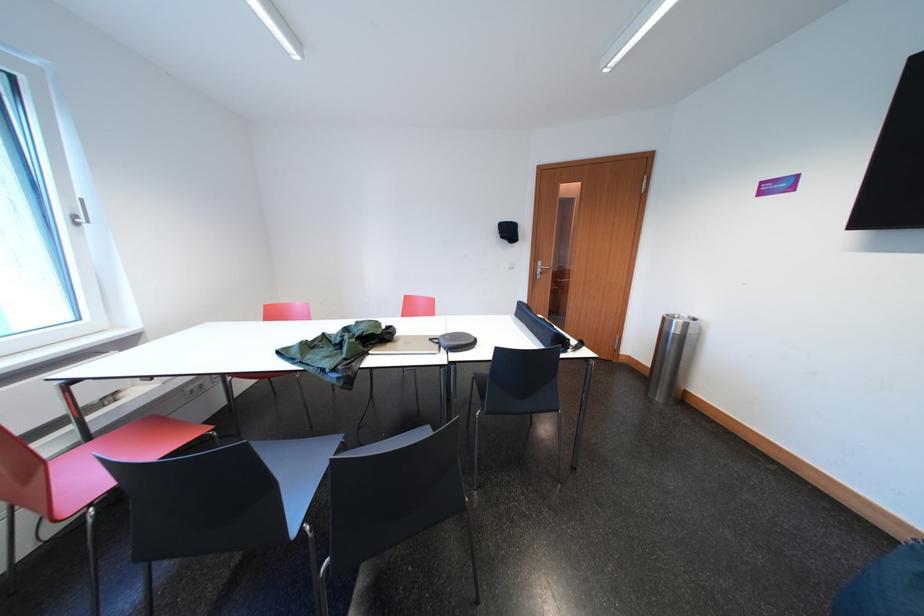
Describe the element at coordinates (111, 459) in the screenshot. Image resolution: width=924 pixels, height=616 pixels. I see `the red chair sitting surface` at that location.